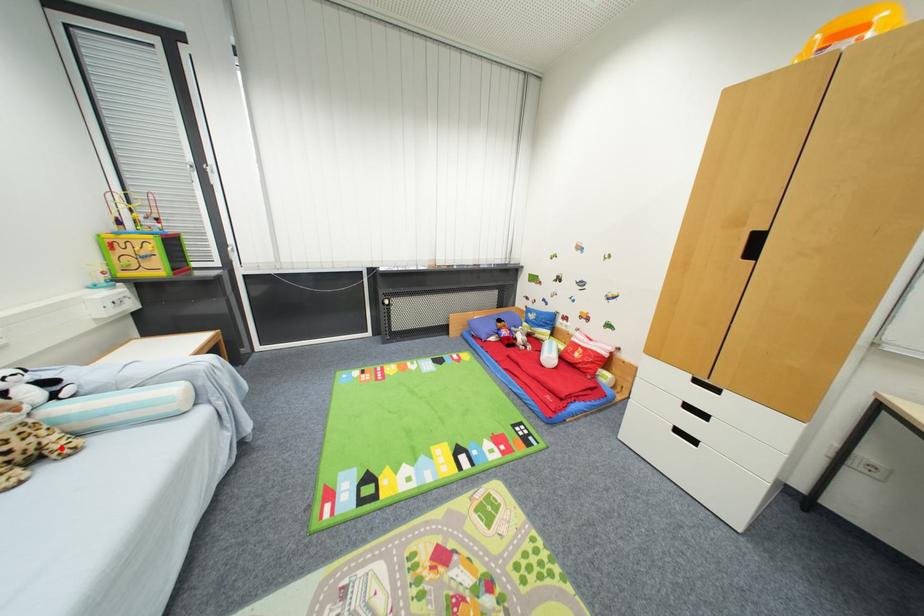
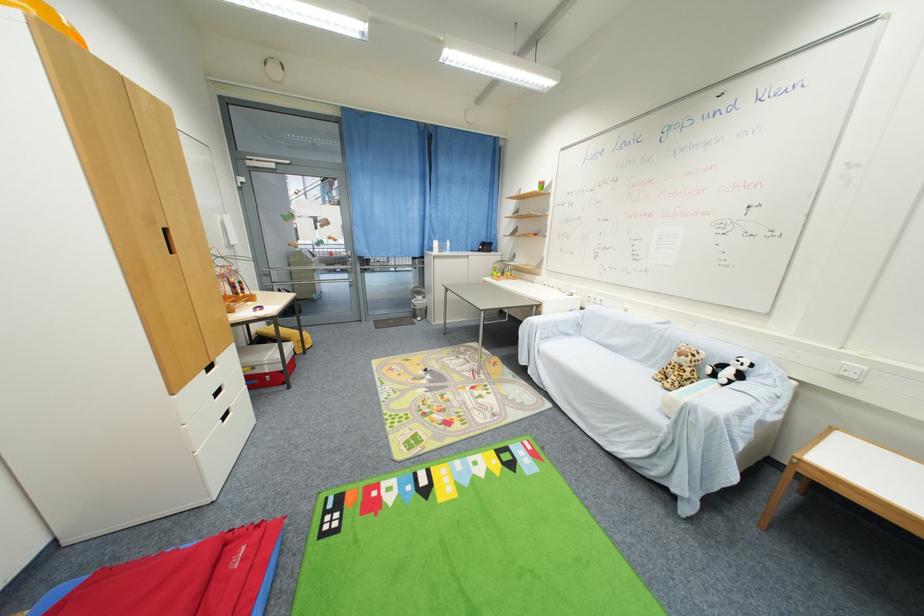
Question: I am providing you with two images of the same scene from different viewpoints. A red point is shown in image1. For the corresponding object point in image2, is it positioned nearer or farther from the camera?

Choices:
 (A) Nearer
 (B) Farther

Answer: (A)